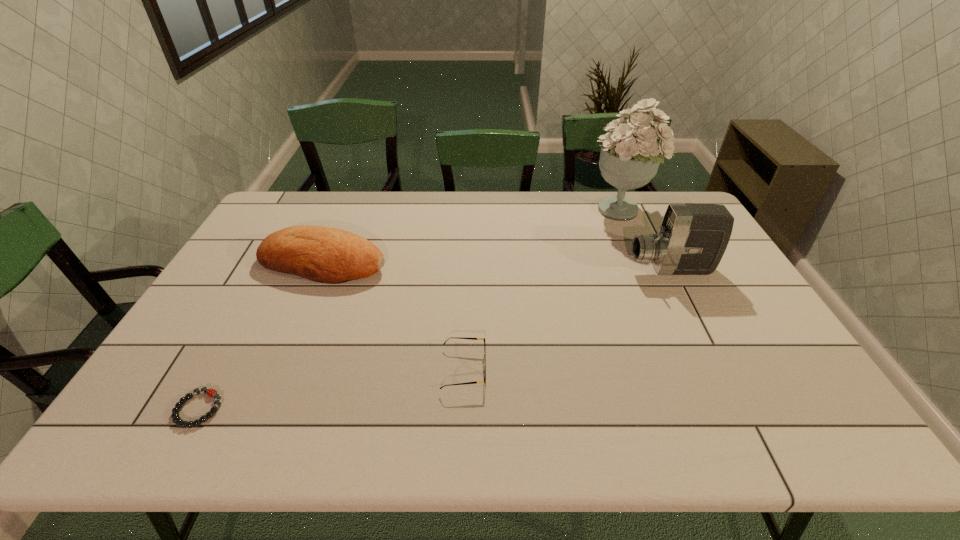
Identify the location of object that is positioned at the near left corner. The height and width of the screenshot is (540, 960). (210, 392).

Locate an element on the screen. Image resolution: width=960 pixels, height=540 pixels. object that is positioned at the far right corner is located at coordinates (630, 156).

You are a GUI agent. You are given a task and a screenshot of the screen. Output one action in this format:
    pyautogui.click(x=<x>, y=<y>)
    Task: Click on the free space at the far edge of the desktop
    
    Given the screenshot: What is the action you would take?
    pyautogui.click(x=559, y=208)

Identify the location of blank space at the near edge. The height and width of the screenshot is (540, 960). (383, 426).

Where is `vacant space at the left edge of the desktop`? Image resolution: width=960 pixels, height=540 pixels. vacant space at the left edge of the desktop is located at coordinates (264, 296).

Locate an element on the screen. This screenshot has height=540, width=960. vacant space at the right edge is located at coordinates (722, 266).

Image resolution: width=960 pixels, height=540 pixels. Identify the location of free location at the far left corner of the desktop. (304, 192).

This screenshot has height=540, width=960. In the image, there is a desktop. In order to click on vacant space at the far right corner in this screenshot , I will do `click(646, 197)`.

I want to click on free location at the near right corner of the desktop, so click(804, 433).

Find the location of `unoccupied area between the second tallest object and the bread`. unoccupied area between the second tallest object and the bread is located at coordinates (497, 266).